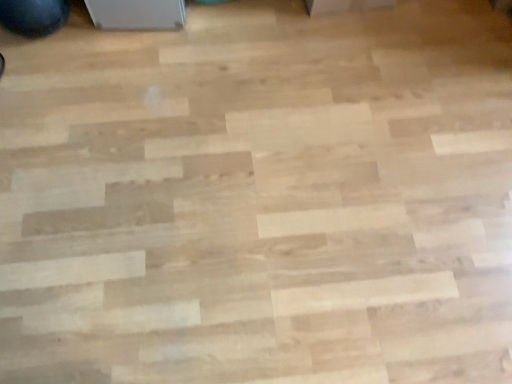
Where is `vacant region to the right of matte black shoe at upper left`? vacant region to the right of matte black shoe at upper left is located at coordinates (x=97, y=51).